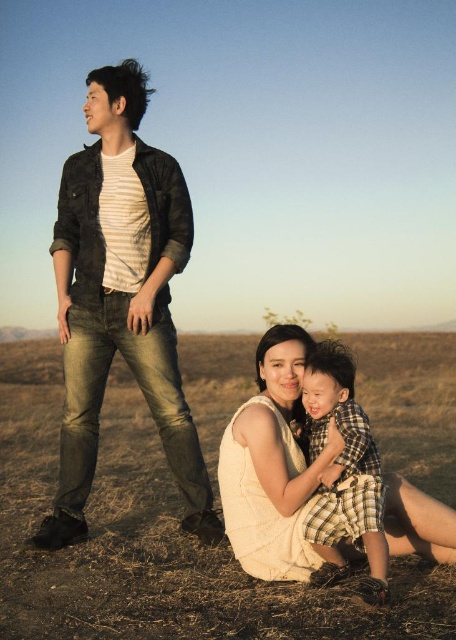
You are a photographer adjusting your camera settings to focus on the brown grass at lower center and the white sleeveless dress at lower center. Which object should you focus on first to ensure both are in sharp focus?

The brown grass at lower center should be focused on first since it is closer to the viewer than the white sleeveless dress at lower center. By focusing on the closer object, the dress will fall within the depth of field and remain in focus as well.

You are a photographer standing at the center of the scene. You want to take a photo that includes both point (31, 369) and point (430, 516). Which point will appear closer to the front of the photo?

Point (31, 369) will appear closer to the front of the photo because it is further to the camera than point (430, 516).

You are a photographer setting up a tripod in the brown grass at lower center and the denim jeans at left. Which area will require more space for the tripod setup?

The brown grass at lower center requires more space for the tripod setup because it is larger in size than the denim jeans at left.